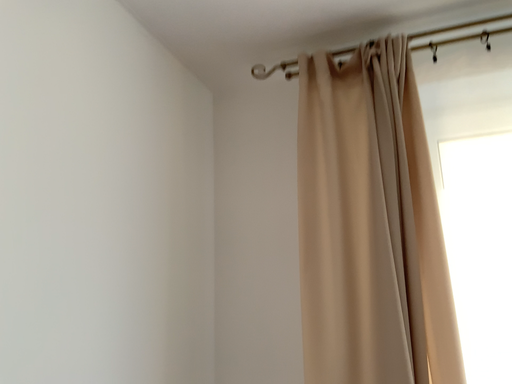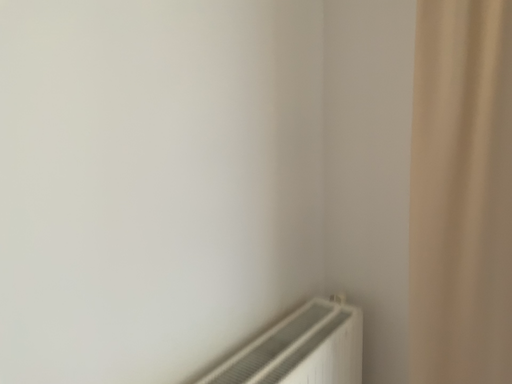
Question: Which way did the camera rotate in the video?

Choices:
 (A) rotated left
 (B) rotated right

Answer: (A)